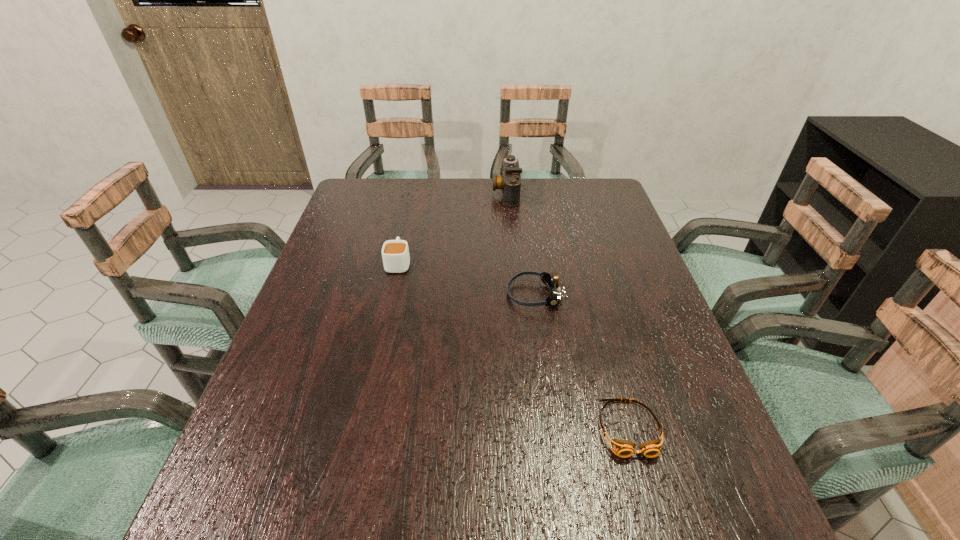
I want to click on vacant space at the far edge of the desktop, so click(542, 179).

The width and height of the screenshot is (960, 540). I want to click on free space at the near edge of the desktop, so click(x=650, y=514).

Locate an element on the screen. The width and height of the screenshot is (960, 540). vacant region at the left edge of the desktop is located at coordinates (376, 217).

At what (x,y) coordinates should I click in order to perform the action: click on free space at the right edge of the desktop. Please return your answer as a coordinate pair (x, y). The width and height of the screenshot is (960, 540). Looking at the image, I should click on (609, 294).

Find the location of a particular element. This screenshot has width=960, height=540. vacant space at the far right corner is located at coordinates (588, 192).

The height and width of the screenshot is (540, 960). I want to click on unoccupied position between the taller goggles and the farthest object, so click(x=520, y=244).

The width and height of the screenshot is (960, 540). What are the coordinates of `vacant space that is in between the second nearest object and the shorter goggles` in the screenshot? It's located at (582, 361).

Find the location of a particular element. The image size is (960, 540). free spot between the second nearest object and the rightmost object is located at coordinates (582, 361).

Locate an element on the screen. This screenshot has height=540, width=960. vacant area that lies between the cup and the right goggles is located at coordinates (514, 346).

You are a GUI agent. You are given a task and a screenshot of the screen. Output one action in this format:
    pyautogui.click(x=<x>, y=<y>)
    Task: Click on the vacant space in between the cup and the farther goggles
    
    Given the screenshot: What is the action you would take?
    pyautogui.click(x=467, y=279)